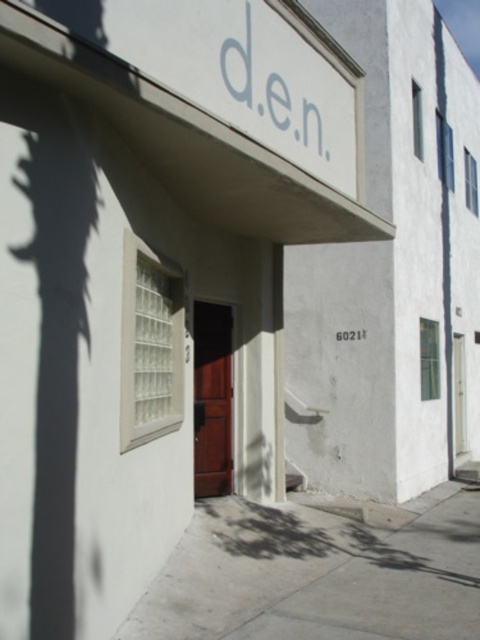
Which of these two, gray concrete pavement at center or brown wooden door at center, stands taller?

With more height is brown wooden door at center.

The image size is (480, 640). I want to click on gray concrete pavement at center, so click(320, 572).